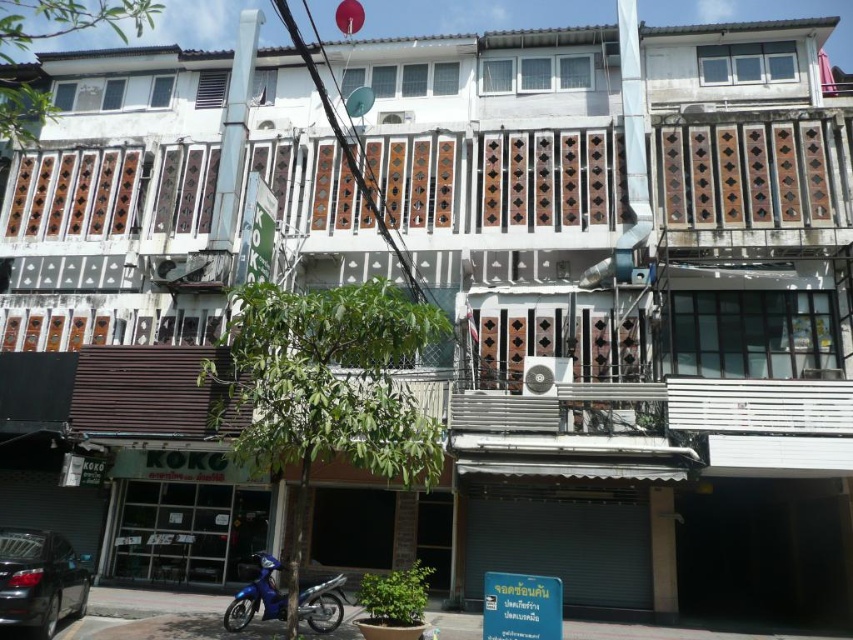
Which is more to the left, shiny black car at lower left or blue matte motorcycle at lower left?

From the viewer's perspective, shiny black car at lower left appears more on the left side.

Between point (18, 611) and point (320, 625), which one is positioned behind?

The point (320, 625) is more distant.

The image size is (853, 640). Identify the location of shiny black car at lower left. (39, 580).